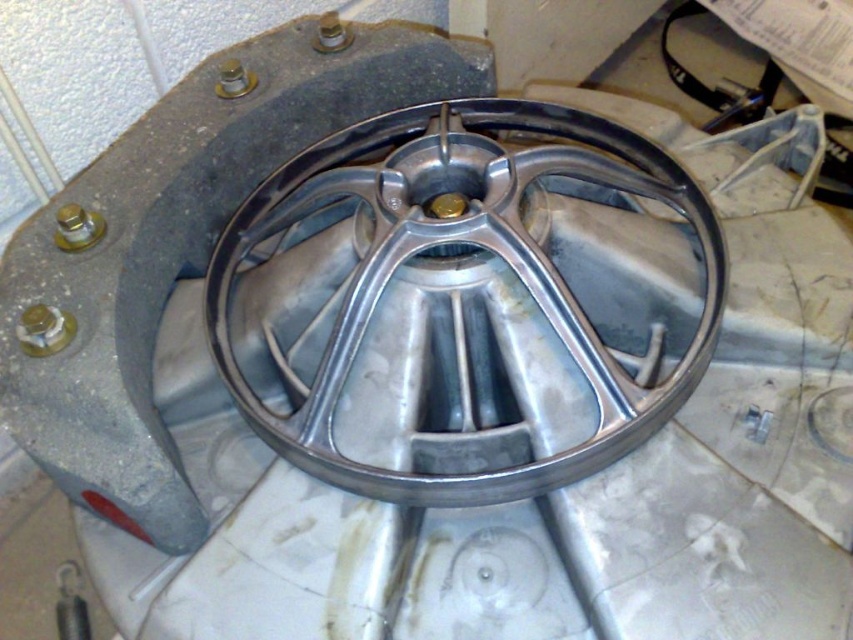
Does point (550, 268) come closer to viewer compared to point (91, 212)?

That is True.

Can you confirm if polished silver rim at center is positioned below matte gold bolt at upper left?

Yes, polished silver rim at center is below matte gold bolt at upper left.

The width and height of the screenshot is (853, 640). Identify the location of polished silver rim at center. (486, 248).

Is point (73, 218) behind point (460, 198)?

Yes, point (73, 218) is behind point (460, 198).

The width and height of the screenshot is (853, 640). I want to click on matte gold bolt at upper left, so click(x=77, y=227).

Is matte silver bolt at upper left to the left of matte gold bolt at upper left from the viewer's perspective?

Correct, you'll find matte silver bolt at upper left to the left of matte gold bolt at upper left.

Looking at this image, between matte silver bolt at upper left and matte gold bolt at upper left, which one appears on the right side from the viewer's perspective?

matte gold bolt at upper left

Who is more forward, (55, 317) or (94, 218)?

Point (55, 317) is more forward.

In order to click on matte silver bolt at upper left in this screenshot , I will do [44, 330].